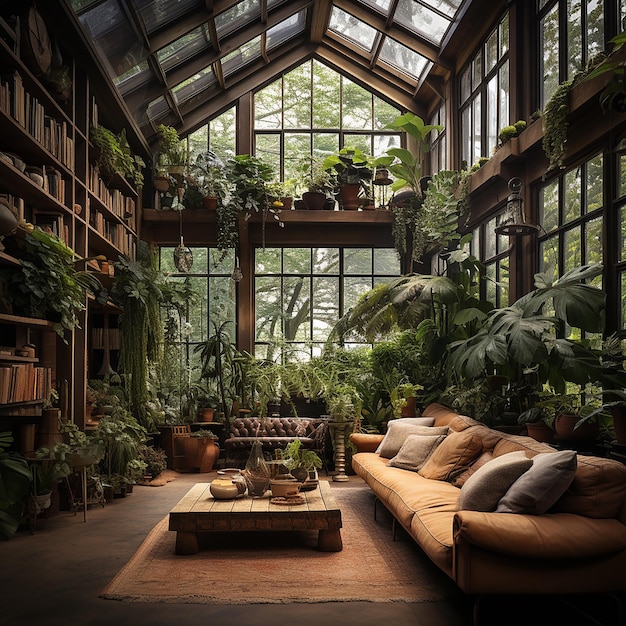
Find the location of `objects on table`. objects on table is located at coordinates (223, 488), (235, 476), (254, 475), (275, 484), (308, 485), (297, 475), (273, 471), (290, 501).